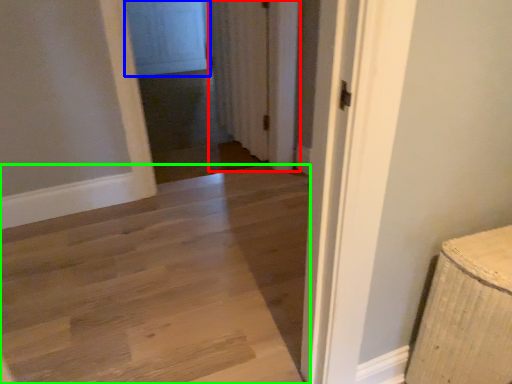
Question: Which object is the closest to the curtain (highlighted by a red box)? Choose among these: screen door (highlighted by a blue box) or path (highlighted by a green box).

Choices:
 (A) screen door
 (B) path

Answer: (B)